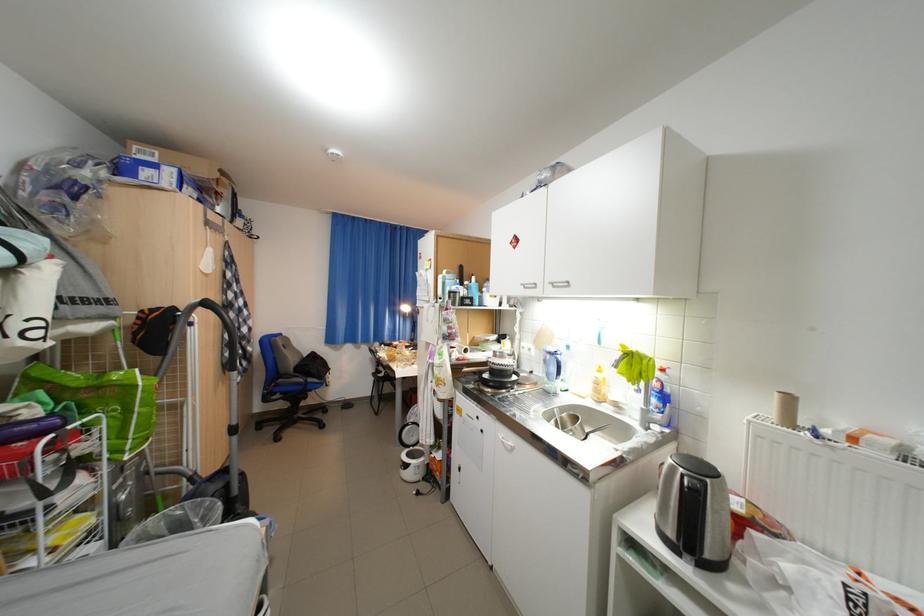
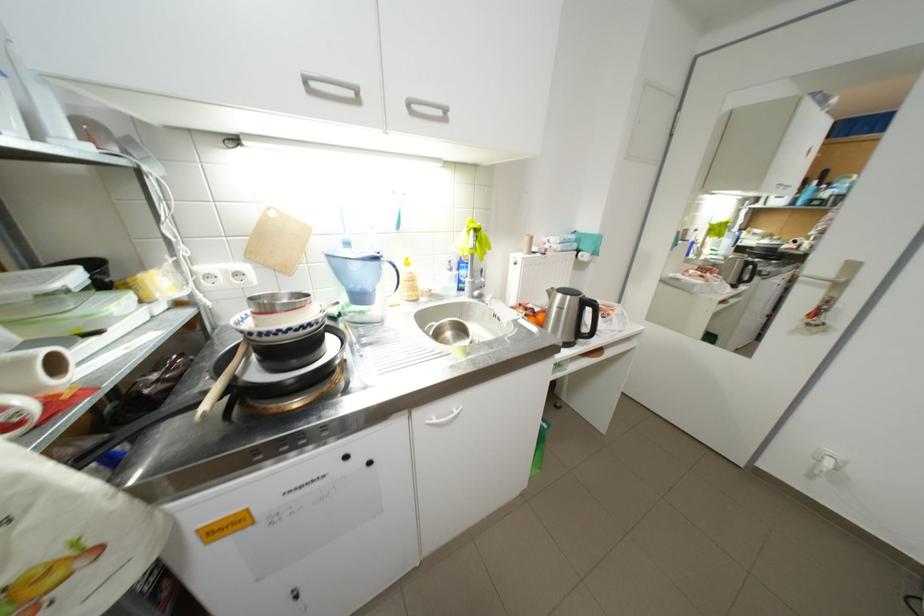
Find the pixel in the second image that matches pixel 565 355 in the first image.

(387, 259)